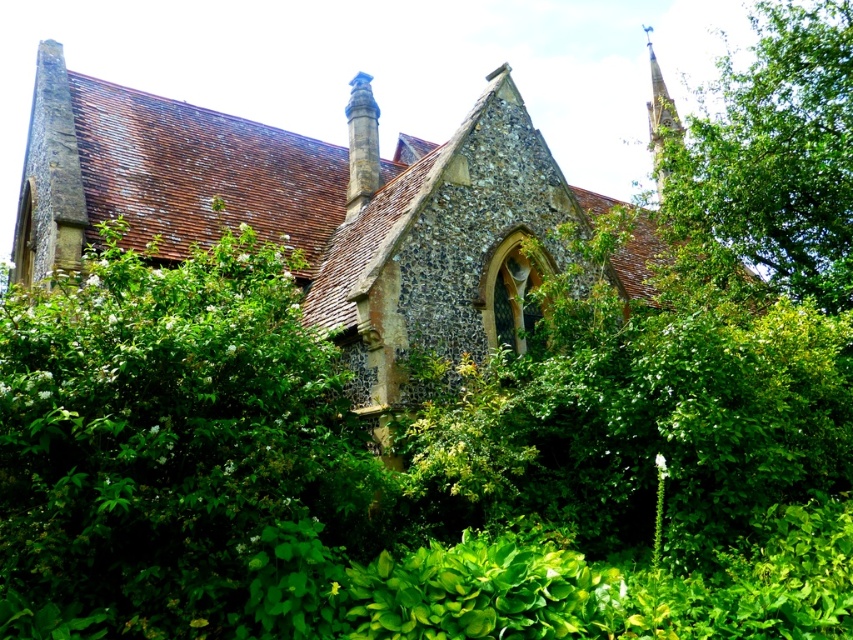
Question: Where is green leafy bush at center located in relation to stone church at center in the image?

Choices:
 (A) above
 (B) below

Answer: (B)

Question: Which object is the closest to the green leafy tree at upper right?

Choices:
 (A) stone church at center
 (B) smooth stone spire at upper right
 (C) green leafy bush at center

Answer: (B)

Question: Where is green leafy tree at upper right located in relation to smooth stone spire at upper right in the image?

Choices:
 (A) above
 (B) below

Answer: (B)

Question: Is stone church at center to the right of green leafy tree at upper right from the viewer's perspective?

Choices:
 (A) yes
 (B) no

Answer: (B)

Question: Among these objects, which one is farthest from the camera?

Choices:
 (A) smooth stone spire at upper right
 (B) green leafy bush at center
 (C) green leafy tree at upper right
 (D) stone church at center

Answer: (A)

Question: Which point is closer to the camera taking this photo?

Choices:
 (A) (157, 192)
 (B) (229, 413)
 (C) (659, 129)

Answer: (B)